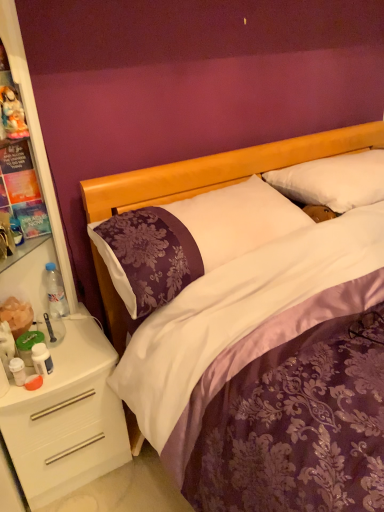
Question: Does white plastic dresser at left appear on the right side of matte plastic figurine at upper left?

Choices:
 (A) yes
 (B) no

Answer: (A)

Question: Is white plastic dresser at left behind matte plastic figurine at upper left?

Choices:
 (A) yes
 (B) no

Answer: (B)

Question: Is white plastic dresser at left taller than matte plastic figurine at upper left?

Choices:
 (A) yes
 (B) no

Answer: (A)

Question: From a real-world perspective, is white plastic dresser at left physically above matte plastic figurine at upper left?

Choices:
 (A) yes
 (B) no

Answer: (B)

Question: Is white plastic dresser at left facing away from matte plastic figurine at upper left?

Choices:
 (A) yes
 (B) no

Answer: (A)

Question: Is white soft pillow at upper center, which is counted as the second pillow, starting from the left, taller or shorter than white plastic drawer at lower left?

Choices:
 (A) tall
 (B) short

Answer: (B)

Question: Is white soft pillow at upper center, marked as the first pillow in a right-to-left arrangement, situated inside white plastic drawer at lower left or outside?

Choices:
 (A) inside
 (B) outside

Answer: (B)

Question: Relative to white plastic drawer at lower left, is white soft pillow at upper center, which is counted as the second pillow, starting from the left, in front or behind?

Choices:
 (A) behind
 (B) front

Answer: (A)

Question: Visually, is white soft pillow at upper center, marked as the first pillow in a right-to-left arrangement, positioned to the left or to the right of white plastic drawer at lower left?

Choices:
 (A) right
 (B) left

Answer: (A)

Question: Is white soft pillow at upper center, which is counted as the second pillow, starting from the left, wider or thinner than white plastic dresser at left?

Choices:
 (A) thin
 (B) wide

Answer: (B)

Question: Is white soft pillow at upper center, which is counted as the second pillow, starting from the left, in front of or behind white plastic dresser at left in the image?

Choices:
 (A) behind
 (B) front

Answer: (A)

Question: From their relative heights in the image, would you say white soft pillow at upper center, marked as the first pillow in a right-to-left arrangement, is taller or shorter than white plastic dresser at left?

Choices:
 (A) short
 (B) tall

Answer: (A)

Question: Do you think white soft pillow at upper center, marked as the first pillow in a right-to-left arrangement, is within white plastic dresser at left, or outside of it?

Choices:
 (A) outside
 (B) inside

Answer: (A)

Question: Relative to clear plastic bottle at left, is matte plastic figurine at upper left in front or behind?

Choices:
 (A) behind
 (B) front

Answer: (B)

Question: From a real-world perspective, relative to clear plastic bottle at left, is matte plastic figurine at upper left vertically above or below?

Choices:
 (A) below
 (B) above

Answer: (B)